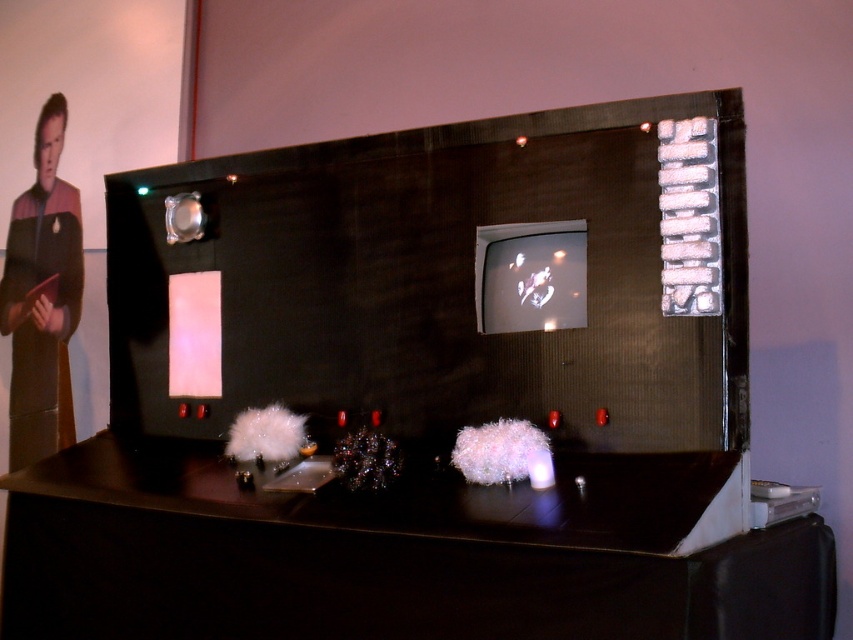
Question: Which point is closer to the camera taking this photo?

Choices:
 (A) (67, 540)
 (B) (56, 444)

Answer: (A)

Question: Can you confirm if dark wood table at center is thinner than uniform fabric man at left?

Choices:
 (A) yes
 (B) no

Answer: (B)

Question: Is dark wood table at center to the right of uniform fabric man at left from the viewer's perspective?

Choices:
 (A) no
 (B) yes

Answer: (B)

Question: In this image, where is dark wood table at center located relative to uniform fabric man at left?

Choices:
 (A) below
 (B) above

Answer: (A)